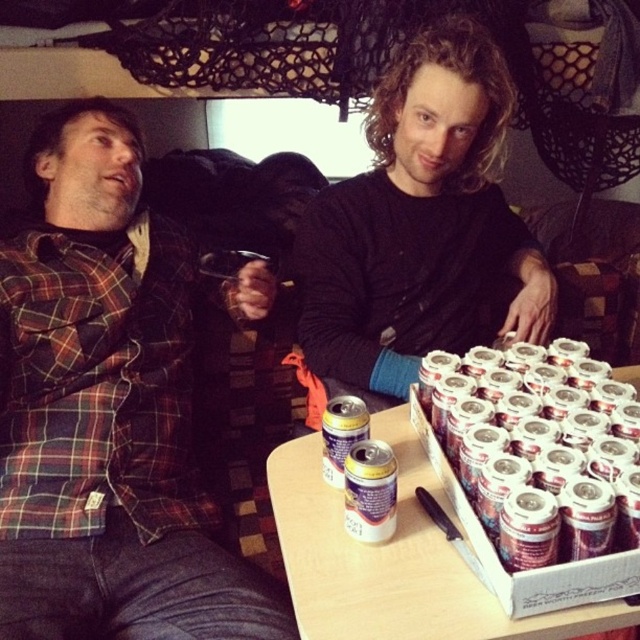
Is black matte shirt at center smaller than yellow metallic can at center?

No, black matte shirt at center is not smaller than yellow metallic can at center.

Does black matte shirt at center come behind yellow metallic can at center?

Yes, black matte shirt at center is further from the viewer.

Between point (300, 248) and point (328, 445), which one is positioned behind?

The point (300, 248) is more distant.

Where is `black matte shirt at center`? black matte shirt at center is located at coordinates (419, 225).

Can you confirm if metallic silver table at center is positioned below yellow metallic can at center?

Indeed, metallic silver table at center is positioned under yellow metallic can at center.

Is the position of metallic silver table at center less distant than that of yellow metallic can at center?

Yes.

Who is more forward, (486, 620) or (353, 404)?

Point (486, 620) is in front.

At what (x,y) coordinates should I click in order to perform the action: click on metallic silver table at center. Please return your answer as a coordinate pair (x, y). This screenshot has height=640, width=640. Looking at the image, I should click on (424, 557).

I want to click on plaid fabric shirt at left, so click(x=108, y=412).

Does point (67, 202) come in front of point (516, 566)?

No, (67, 202) is behind (516, 566).

Does point (48, 232) lie behind point (547, 556)?

Yes, point (48, 232) is farther from viewer.

Locate an element on the screen. plaid fabric shirt at left is located at coordinates (108, 412).